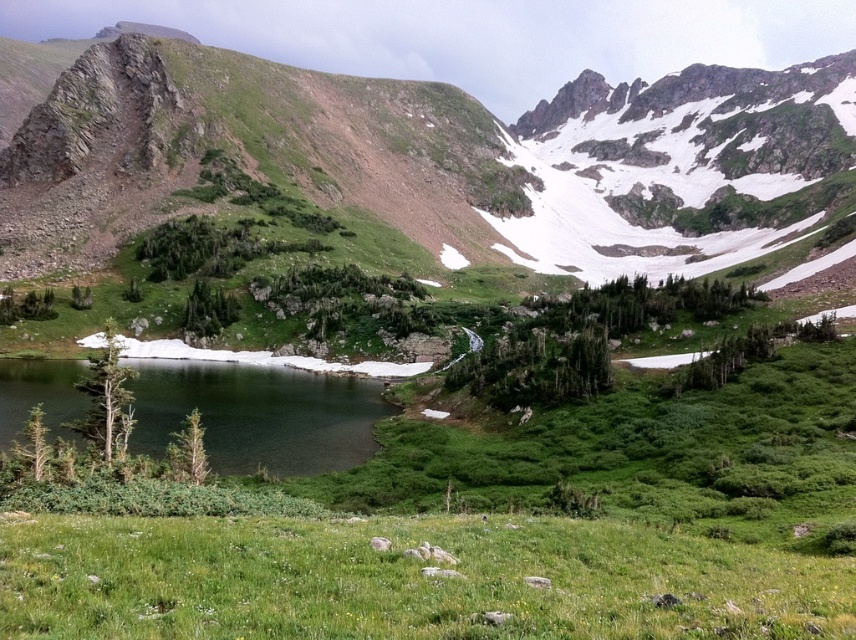
Between point (666, 545) and point (247, 392), which one is positioned behind?

The point (247, 392) is more distant.

Between green grassy field at lower center and green glassy water at lower left, which one appears on the right side from the viewer's perspective?

Positioned to the right is green grassy field at lower center.

Does point (135, 602) come farther from viewer compared to point (340, 413)?

That is False.

Find the location of a particular element. The width and height of the screenshot is (856, 640). green grassy field at lower center is located at coordinates (405, 580).